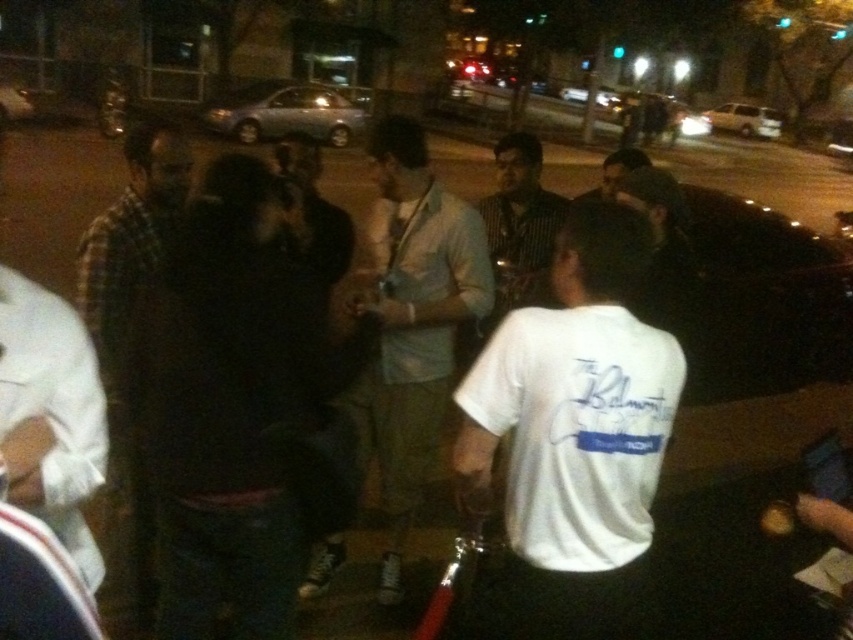
Question: Does light blue cotton shirt at center appear over striped shirt at center?

Choices:
 (A) yes
 (B) no

Answer: (B)

Question: Among these objects, which one is farthest from the camera?

Choices:
 (A) white cotton t-shirt at center
 (B) striped shirt at center
 (C) light blue cotton shirt at center
 (D) plaid fabric shirt at left

Answer: (B)

Question: Among these points, which one is farthest from the camera?

Choices:
 (A) (440, 385)
 (B) (540, 150)
 (C) (134, 237)

Answer: (B)

Question: Does white cotton t-shirt at center appear on the right side of plaid fabric shirt at left?

Choices:
 (A) no
 (B) yes

Answer: (B)

Question: Is the position of plaid fabric shirt at left less distant than that of striped shirt at center?

Choices:
 (A) no
 (B) yes

Answer: (B)

Question: Which point is farther to the camera?

Choices:
 (A) plaid fabric shirt at left
 (B) white cotton t-shirt at center

Answer: (A)